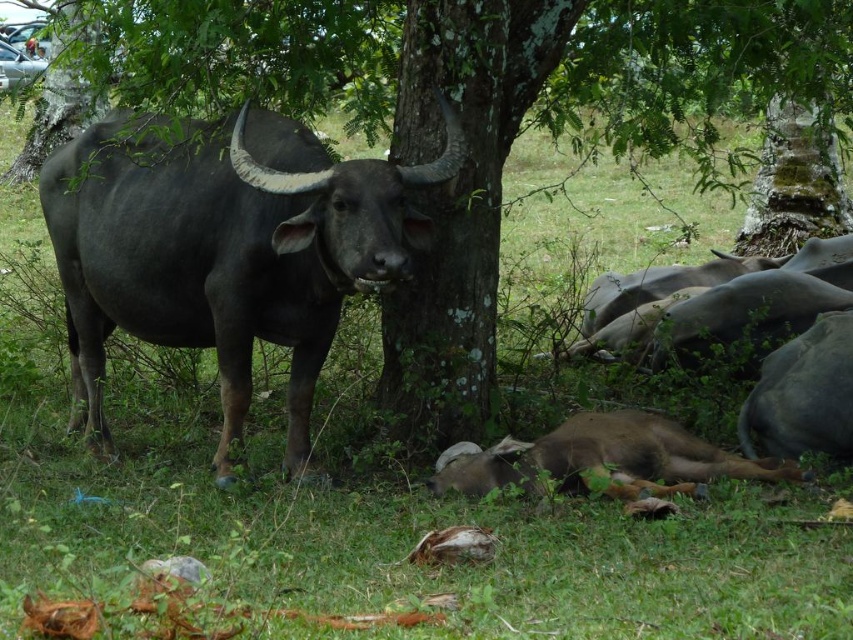
Consider the image. Can you confirm if green rough bark tree at center is bigger than shiny black bull at center?

No, green rough bark tree at center is not bigger than shiny black bull at center.

Who is lower down, green rough bark tree at center or shiny black bull at center?

shiny black bull at center is lower down.

Where is `green rough bark tree at center`? This screenshot has width=853, height=640. green rough bark tree at center is located at coordinates (497, 118).

I want to click on green rough bark tree at center, so click(x=497, y=118).